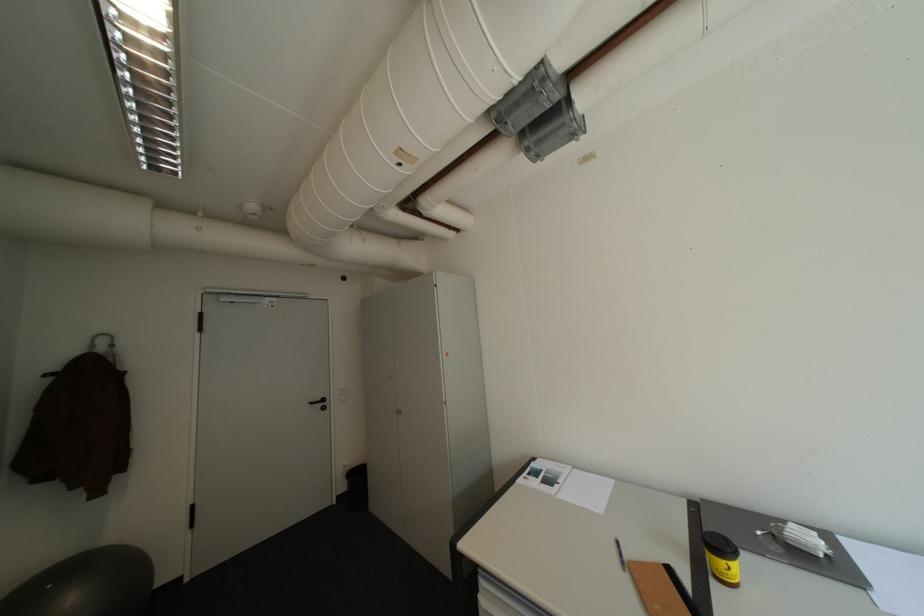
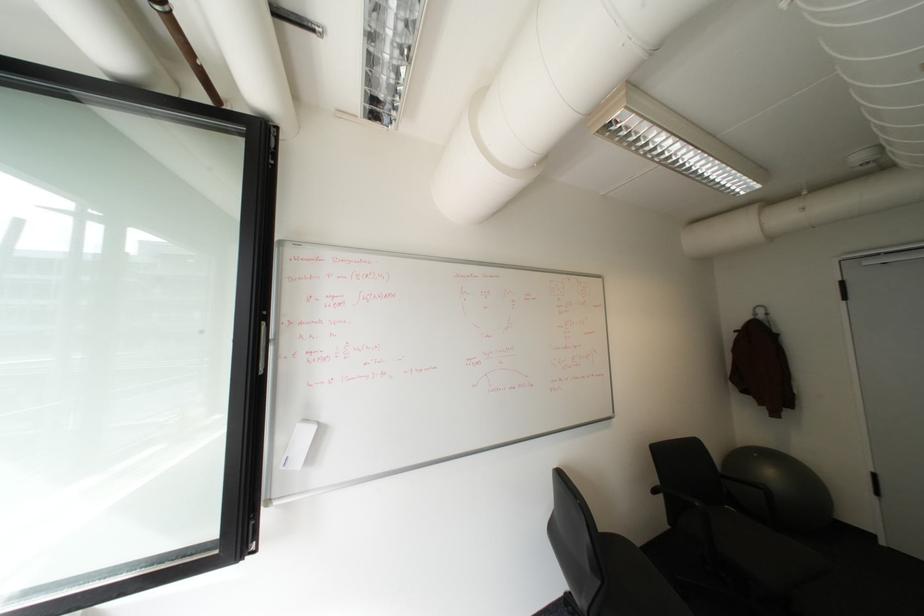
Question: How did the camera likely rotate?

Choices:
 (A) Left
 (B) Right
 (C) Up
 (D) Down

Answer: (A)